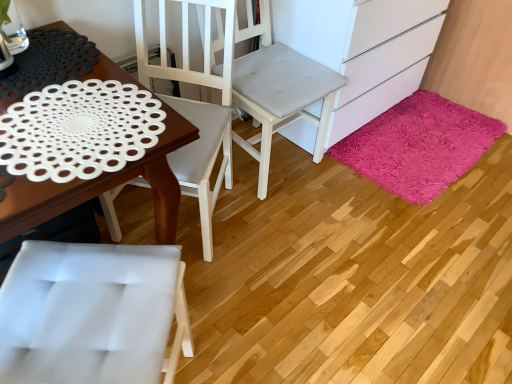
Question: From a real-world perspective, is white matte cabinet at lower right physically above shaggy pink rug at lower right?

Choices:
 (A) no
 (B) yes

Answer: (B)

Question: From a real-world perspective, is white matte cabinet at lower right beneath shaggy pink rug at lower right?

Choices:
 (A) yes
 (B) no

Answer: (B)

Question: Does white matte cabinet at lower right have a greater width compared to shaggy pink rug at lower right?

Choices:
 (A) no
 (B) yes

Answer: (B)

Question: Is white matte cabinet at lower right placed right next to shaggy pink rug at lower right?

Choices:
 (A) yes
 (B) no

Answer: (B)

Question: Is white matte cabinet at lower right taller than shaggy pink rug at lower right?

Choices:
 (A) yes
 (B) no

Answer: (A)

Question: Does white matte cabinet at lower right have a smaller size compared to shaggy pink rug at lower right?

Choices:
 (A) no
 (B) yes

Answer: (A)

Question: From the image's perspective, is white fabric chair at center, which is the first chair in right-to-left order, on top of shaggy pink rug at lower right?

Choices:
 (A) no
 (B) yes

Answer: (B)

Question: Considering the relative sizes of white fabric chair at center, the second chair when ordered from left to right, and shaggy pink rug at lower right in the image provided, is white fabric chair at center, the second chair when ordered from left to right, bigger than shaggy pink rug at lower right?

Choices:
 (A) no
 (B) yes

Answer: (B)

Question: Does white fabric chair at center, the second chair when ordered from left to right, appear on the right side of shaggy pink rug at lower right?

Choices:
 (A) no
 (B) yes

Answer: (A)

Question: Does white fabric chair at center, which is the first chair in right-to-left order, lie behind shaggy pink rug at lower right?

Choices:
 (A) yes
 (B) no

Answer: (B)

Question: Can you confirm if white fabric chair at center, the second chair when ordered from left to right, is taller than shaggy pink rug at lower right?

Choices:
 (A) yes
 (B) no

Answer: (A)

Question: Does white fabric chair at center, which is the first chair in right-to-left order, have a lesser height compared to shaggy pink rug at lower right?

Choices:
 (A) yes
 (B) no

Answer: (B)

Question: Can you confirm if shaggy pink rug at lower right is shorter than white matte doily at left?

Choices:
 (A) yes
 (B) no

Answer: (A)